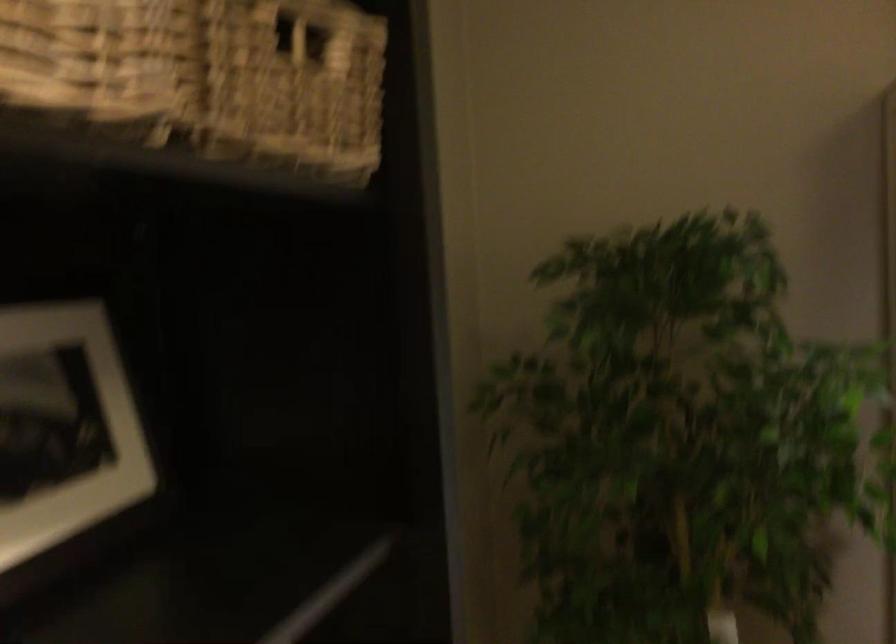
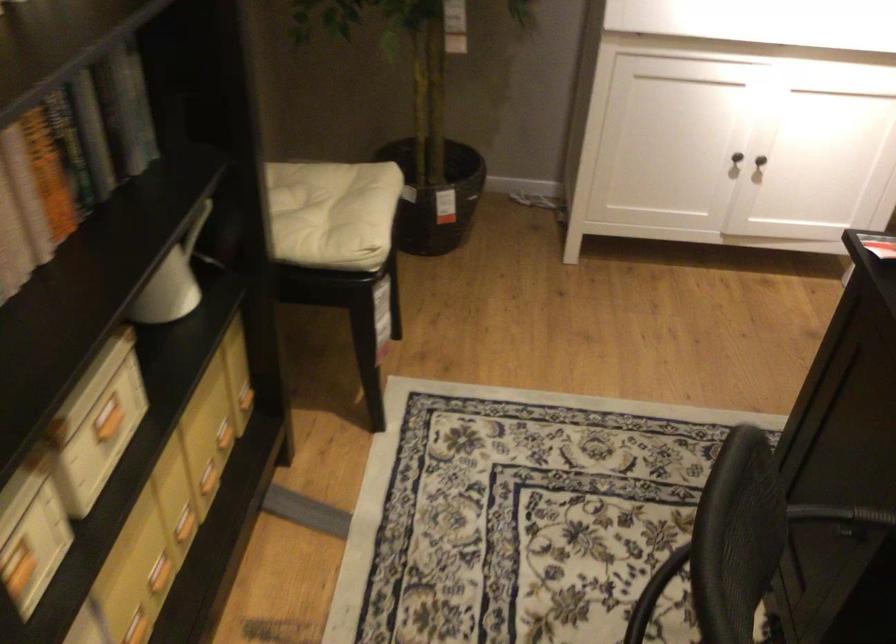
The first image is from the beginning of the video and the second image is from the end. How did the camera likely rotate when shooting the video?

The camera rotated toward right-down.